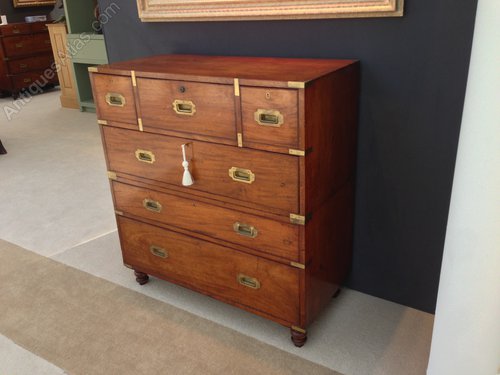
Locate an element on the screen. handle is located at coordinates (244, 232).